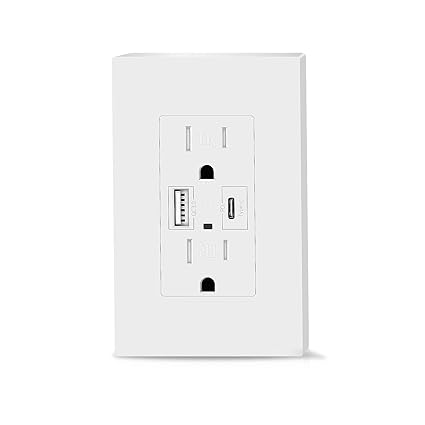
Find the location of a particular element. usb port is located at coordinates (231, 212).